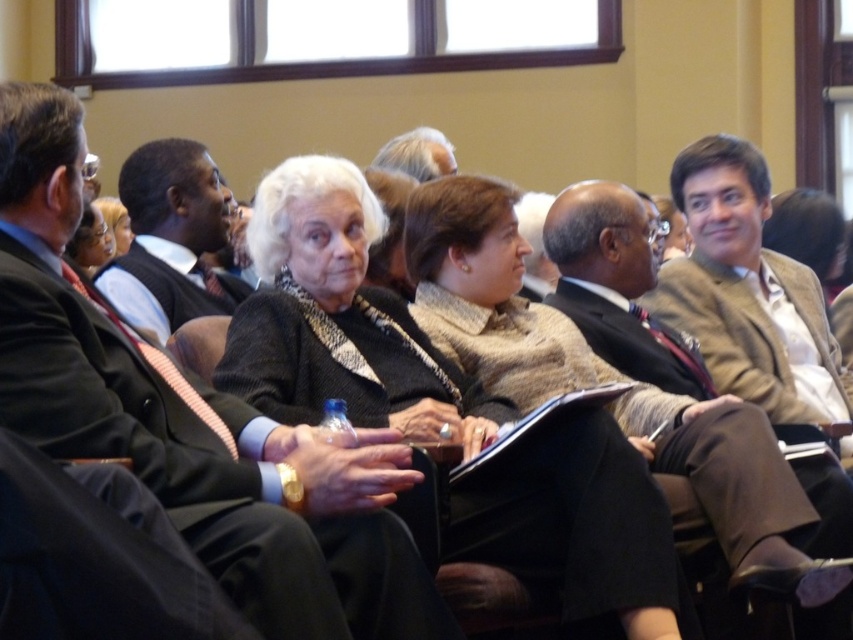
Question: Is matte black suit at center below light brown hair at upper center?

Choices:
 (A) yes
 (B) no

Answer: (A)

Question: Can you confirm if dark gray wool sweater at center is bigger than dark brown suit at left?

Choices:
 (A) no
 (B) yes

Answer: (B)

Question: Which point appears closest to the camera in this image?

Choices:
 (A) (670, 385)
 (B) (271, 225)

Answer: (B)

Question: Which point appears closest to the camera in this image?

Choices:
 (A) (218, 188)
 (B) (692, 369)
 (C) (321, 545)
 (D) (404, 157)

Answer: (C)

Question: Is dark gray wool sweater at center positioned in front of dark brown suit at left?

Choices:
 (A) yes
 (B) no

Answer: (A)

Question: Which object is closer to the camera taking this photo?

Choices:
 (A) dark gray wool sweater at center
 (B) dark brown suit at left

Answer: (A)